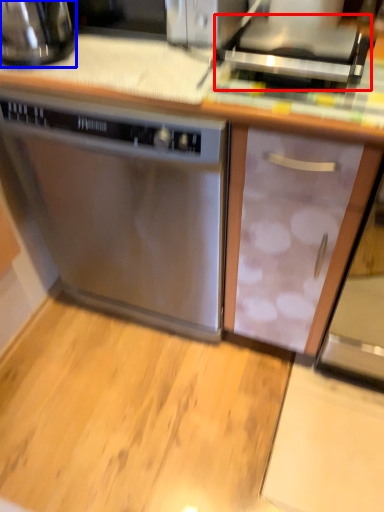
Question: Which point is closer to the camera, appliance (highlighted by a red box) or kitchen appliance (highlighted by a blue box)?

Choices:
 (A) appliance
 (B) kitchen appliance

Answer: (A)